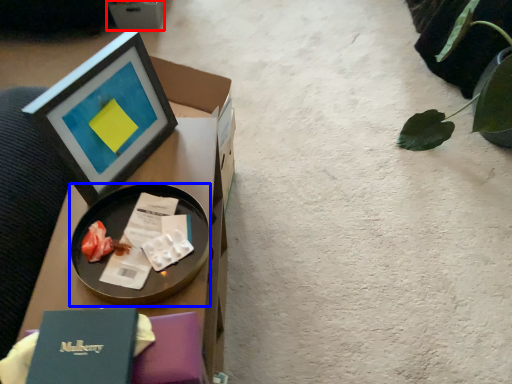
Question: Which object appears farthest to the camera in this image, cardboard box (highlighted by a red box) or tableware (highlighted by a blue box)?

Choices:
 (A) cardboard box
 (B) tableware

Answer: (A)